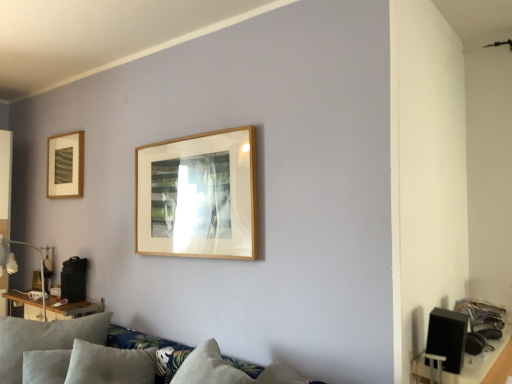
Question: Does point pos(87,334) appear closer or farther from the camera than point pos(309,380)?

Choices:
 (A) closer
 (B) farther

Answer: (B)

Question: Is suede-like gray pillow at lower left wider or thinner than soft gray fabric couch at lower left?

Choices:
 (A) thin
 (B) wide

Answer: (A)

Question: Based on their relative distances, which object is nearer to the black matte speaker at lower right?

Choices:
 (A) soft gray fabric couch at lower left
 (B) matte white lamp at left
 (C) suede-like gray pillow at lower left
 (D) matte gold picture frame at upper left
 (E) wooden table at left

Answer: (A)

Question: Based on their relative distances, which object is nearer to the soft gray fabric couch at lower left?

Choices:
 (A) wooden table at left
 (B) black matte speaker at lower right
 (C) suede-like gray pillow at lower left
 (D) matte gold picture frame at upper left
 (E) matte white lamp at left

Answer: (C)